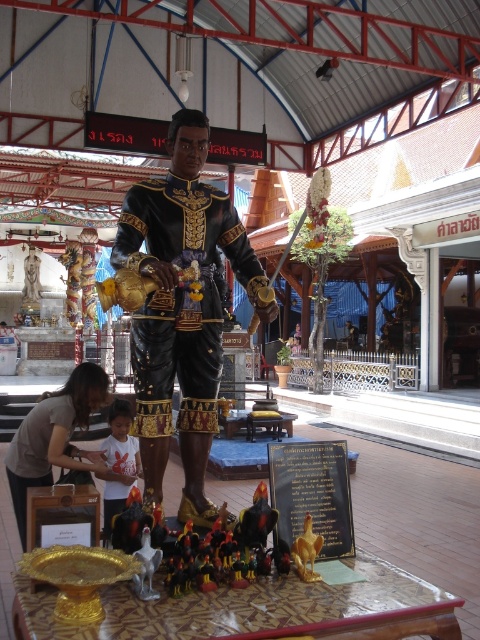
You are an interior designer planning to install a new light fixture in this temple. The light fixture will be placed at the center of the room. Considering the white cotton shirt at center and the gold metallic toy at center, which object will the light fixture be placed below?

The light fixture will be placed below the white cotton shirt at center because it is located above the gold metallic toy at center.

You are a visitor at this temple and want to take a photo of both the white cotton shirt at center and the gold metallic toy at center. Since you want them both in focus, you need to know which object is bigger. Which one is larger?

The white cotton shirt at center is larger than the gold metallic toy at center.